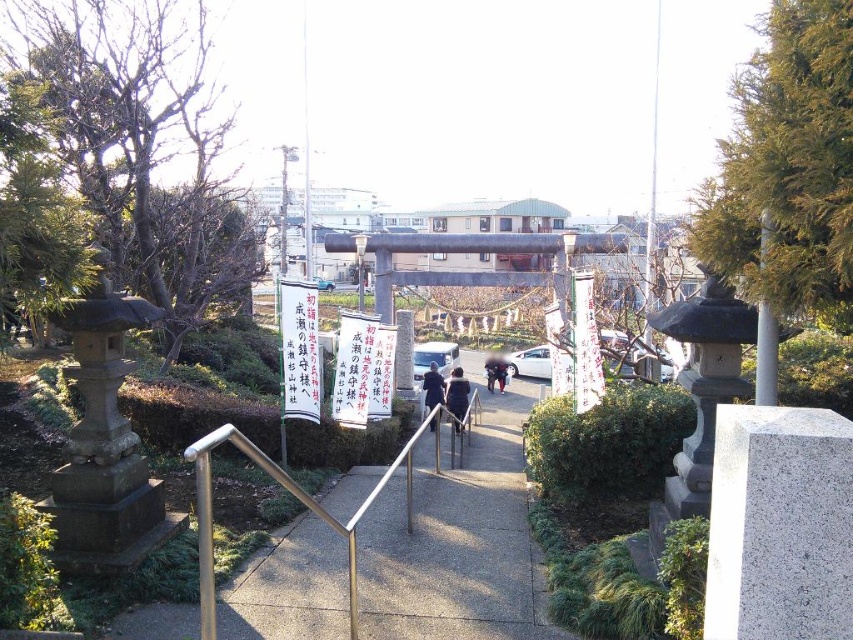
You are a visitor to the Shinto shrine and see the dark blue jacket at center and the dark blue coat at center placed on a bench near the torii gate. Which one takes up less space on the bench?

The dark blue jacket at center takes up less space on the bench because it is smaller than the dark blue coat at center.

You are a photographer standing at the entrance of the torii gate. You see a dark blue jacket at center and a dark blue coat at center. Which clothing item is wider?

The dark blue jacket at center is wider than the dark blue coat at center according to the description.

You are standing at the entrance of the torii gate and see two points marked on the pathway. Which point is closer to you, point (421, 353) or point (438, 396)?

Point (438, 396) is closer to you because it is nearer to the camera than point (421, 353).